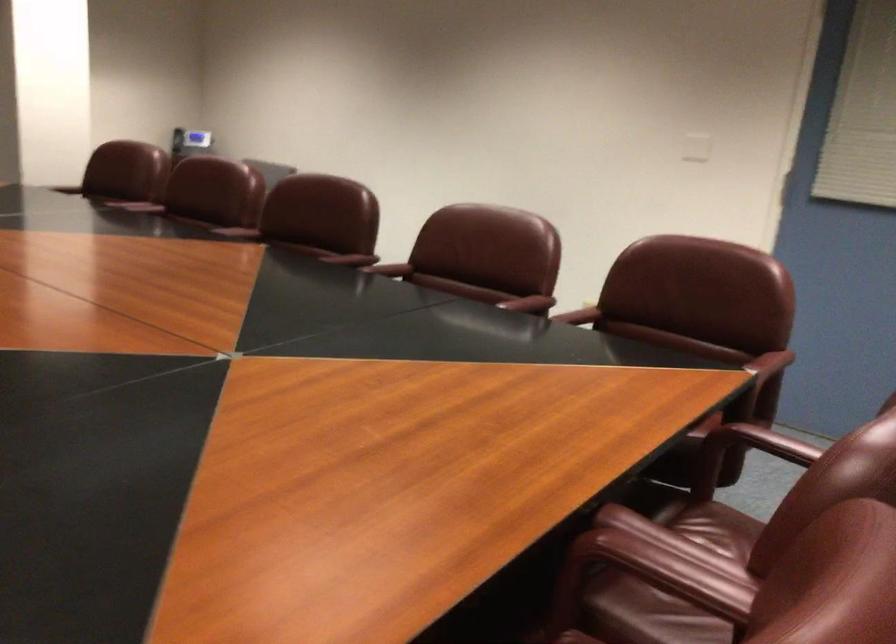
What do you see at coordinates (695, 147) in the screenshot?
I see `the white light switch` at bounding box center [695, 147].